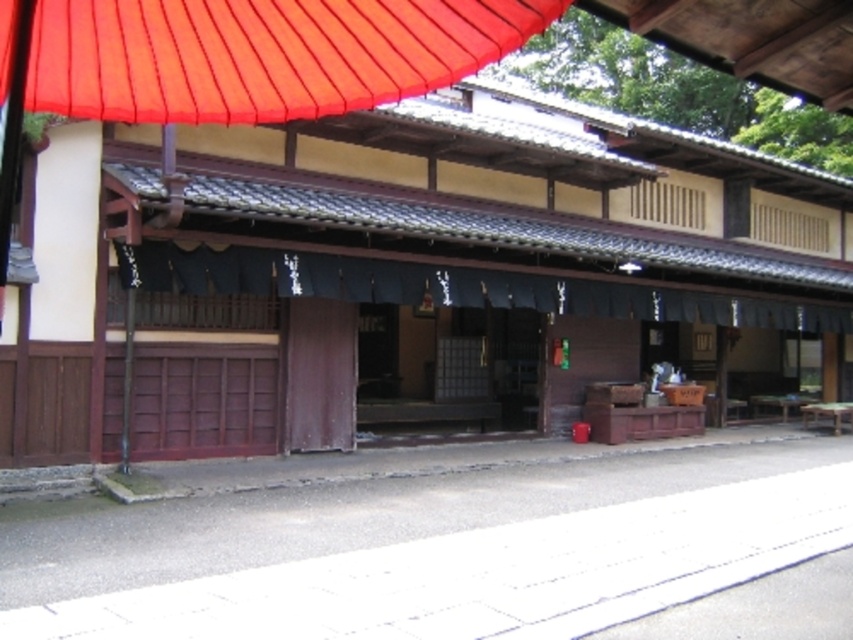
Question: Which of the following is the closest to the observer?

Choices:
 (A) (564, 227)
 (B) (204, 273)

Answer: (B)

Question: Is brown wooden hut at center thinner than blue fabric curtain at center?

Choices:
 (A) no
 (B) yes

Answer: (A)

Question: Does brown wooden hut at center have a smaller size compared to blue fabric curtain at center?

Choices:
 (A) no
 (B) yes

Answer: (A)

Question: Which point is closer to the camera taking this photo?

Choices:
 (A) (331, 291)
 (B) (171, 289)

Answer: (B)

Question: Is brown wooden hut at center to the left of blue fabric curtain at center from the viewer's perspective?

Choices:
 (A) no
 (B) yes

Answer: (B)

Question: Which point is farther from the camera taking this photo?

Choices:
 (A) (277, 257)
 (B) (409, 236)

Answer: (A)